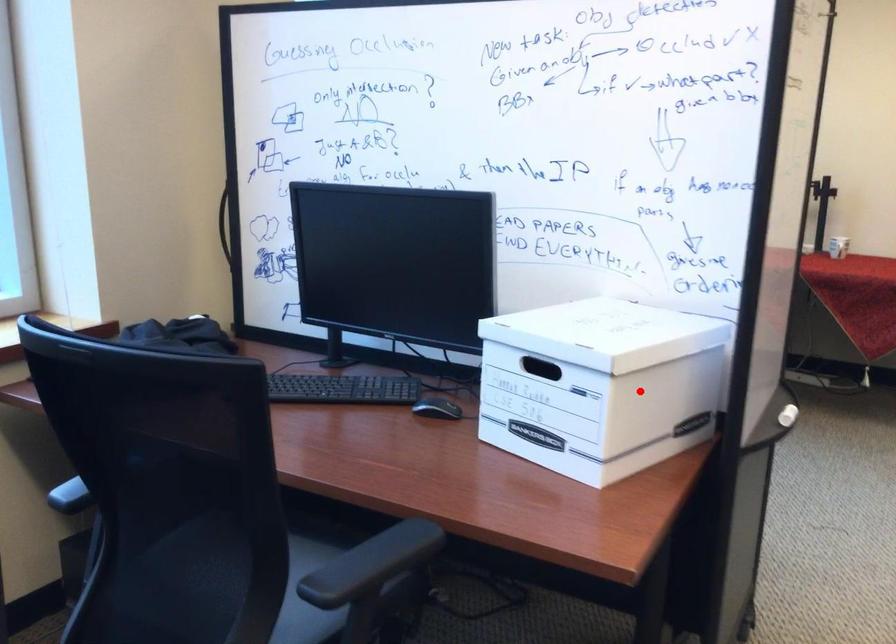
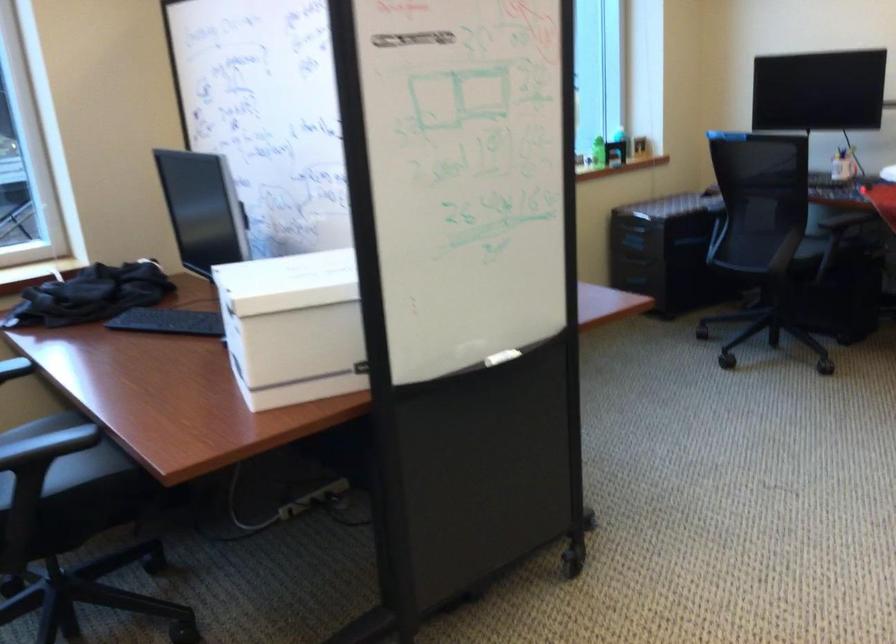
Question: A red point is marked in image1. In image2, is the corresponding 3D point closer to the camera or farther? Reply with the corresponding letter.

Choices:
 (A) The corresponding 3D point is closer.
 (B) The corresponding 3D point is farther.

Answer: (B)